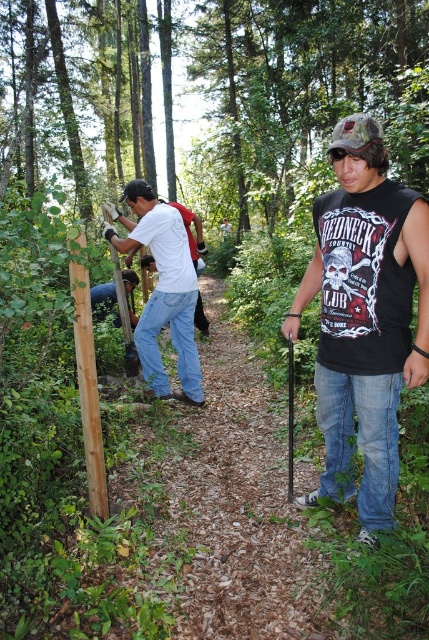
How far apart are black sleeveless shirt at center and matte white shirt at center?

black sleeveless shirt at center and matte white shirt at center are 6.07 feet apart from each other.

Who is shorter, black sleeveless shirt at center or matte white shirt at center?

matte white shirt at center

Is point (371, 419) closer to viewer compared to point (193, 397)?

Yes, point (371, 419) is in front of point (193, 397).

At what (x,y) coordinates should I click in order to perform the action: click on black sleeveless shirt at center. Please return your answer as a coordinate pair (x, y). This screenshot has height=640, width=429. Looking at the image, I should click on (365, 317).